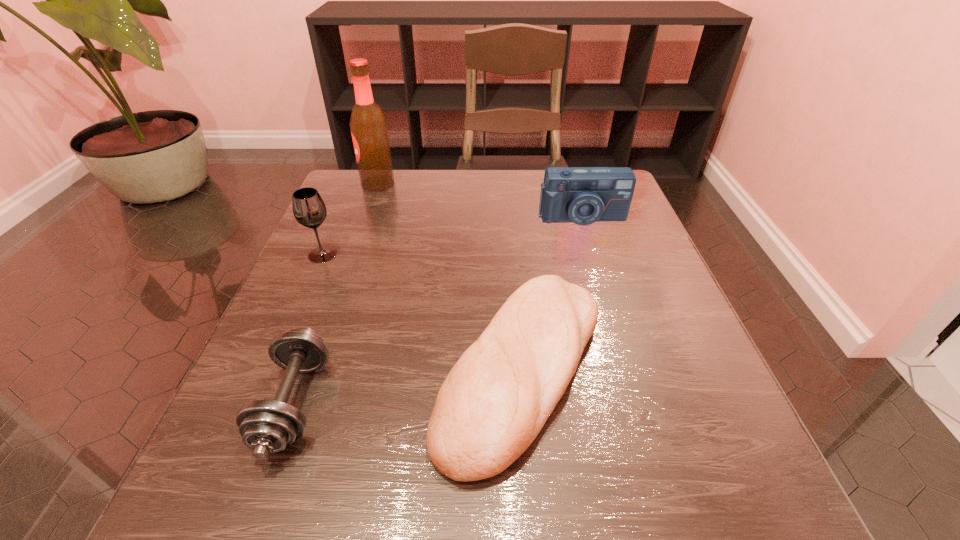
Locate an element on the screen. free spot located on the lens of the second farthest object is located at coordinates (631, 379).

This screenshot has height=540, width=960. In order to click on free space located on the back of the bread in this screenshot , I will do `click(512, 260)`.

The height and width of the screenshot is (540, 960). In order to click on free space located 0.140m on the right of the dumbbell in this screenshot , I will do [x=421, y=403].

You are a GUI agent. You are given a task and a screenshot of the screen. Output one action in this format:
    pyautogui.click(x=<x>, y=<y>)
    Task: Click on the beer bottle positioned at the far edge
    This screenshot has width=960, height=540.
    Given the screenshot: What is the action you would take?
    pyautogui.click(x=368, y=125)

Locate an element on the screen. The width and height of the screenshot is (960, 540). camera situated at the far edge is located at coordinates (583, 195).

You are a GUI agent. You are given a task and a screenshot of the screen. Output one action in this format:
    pyautogui.click(x=<x>, y=<y>)
    Task: Click on the bread that is at the near edge
    The width and height of the screenshot is (960, 540).
    Given the screenshot: What is the action you would take?
    pyautogui.click(x=495, y=400)

Image resolution: width=960 pixels, height=540 pixels. I want to click on dumbbell that is at the near edge, so click(x=267, y=426).

You are a GUI agent. You are given a task and a screenshot of the screen. Output one action in this format:
    pyautogui.click(x=<x>, y=<y>)
    Task: Click on the beer bottle that is at the left edge
    The height and width of the screenshot is (540, 960).
    Given the screenshot: What is the action you would take?
    pyautogui.click(x=368, y=125)

This screenshot has height=540, width=960. In order to click on wineglass that is at the left edge in this screenshot , I will do `click(309, 209)`.

Locate an element on the screen. This screenshot has height=540, width=960. dumbbell present at the left edge is located at coordinates (267, 426).